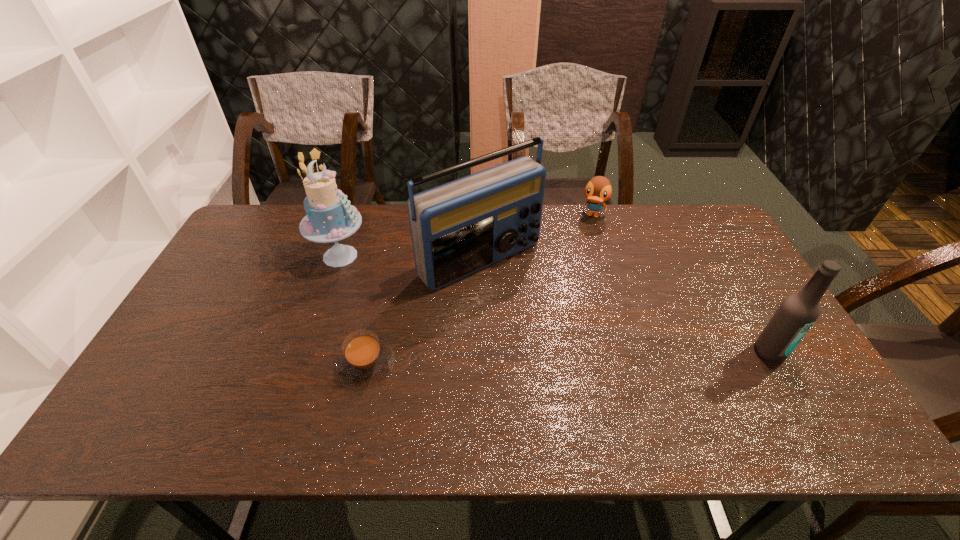
In order to click on duck present at the far edge in this screenshot , I will do `click(598, 190)`.

Image resolution: width=960 pixels, height=540 pixels. What are the coordinates of `object that is at the near edge` in the screenshot? It's located at (365, 360).

Where is `object present at the right edge`? object present at the right edge is located at coordinates (798, 312).

Image resolution: width=960 pixels, height=540 pixels. What are the coordinates of `free space at the far edge of the desktop` in the screenshot? It's located at [372, 207].

This screenshot has width=960, height=540. I want to click on vacant region at the left edge of the desktop, so click(x=221, y=265).

The width and height of the screenshot is (960, 540). In the image, there is a desktop. Find the location of `free region at the far right corner`. free region at the far right corner is located at coordinates (688, 244).

Where is `blank region between the third object from right to left and the shortest object`? blank region between the third object from right to left and the shortest object is located at coordinates (423, 312).

At what (x,y) coordinates should I click in order to perform the action: click on free space between the cappuccino and the third tallest object. Please return your answer as a coordinate pair (x, y). This screenshot has height=540, width=960. Looking at the image, I should click on (568, 358).

The width and height of the screenshot is (960, 540). Identify the location of empty space between the cappuccino and the rightmost object. (568, 358).

You are a GUI agent. You are given a task and a screenshot of the screen. Output one action in this format:
    pyautogui.click(x=<x>, y=<y>)
    Task: Click on the object that can be found as the second closest to the farthest object
    The height and width of the screenshot is (540, 960).
    Given the screenshot: What is the action you would take?
    pyautogui.click(x=798, y=312)